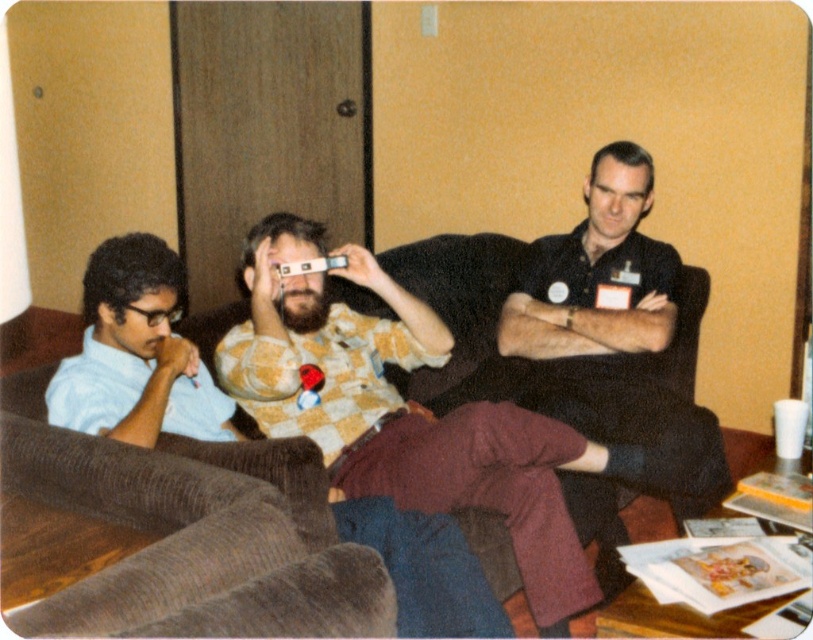
Question: Is the position of black matte shirt at center less distant than that of light blue shirt at left?

Choices:
 (A) yes
 (B) no

Answer: (B)

Question: Which point is farther to the camera?

Choices:
 (A) brown fabric couch at center
 (B) black matte shirt at center
 (C) light blue shirt at left

Answer: (B)

Question: Which point appears closest to the camera in this image?

Choices:
 (A) coord(50,598)
 (B) coord(98,417)

Answer: (A)

Question: Is brown fabric couch at center below light blue shirt at left?

Choices:
 (A) yes
 (B) no

Answer: (A)

Question: Does brown fabric couch at center have a lesser width compared to light blue shirt at left?

Choices:
 (A) yes
 (B) no

Answer: (B)

Question: Which point is closer to the camera?

Choices:
 (A) brown fabric couch at center
 (B) light blue shirt at left
 (C) black matte shirt at center

Answer: (A)